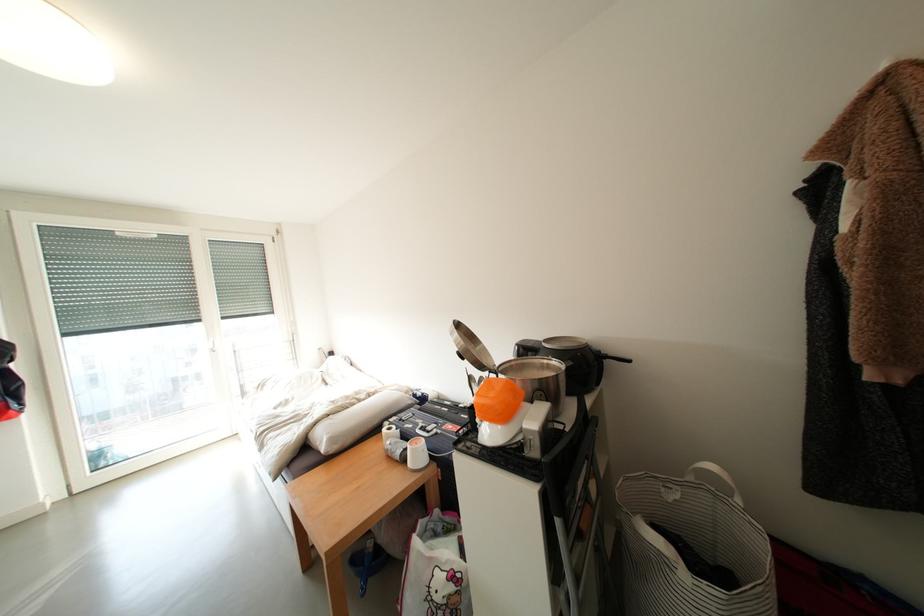
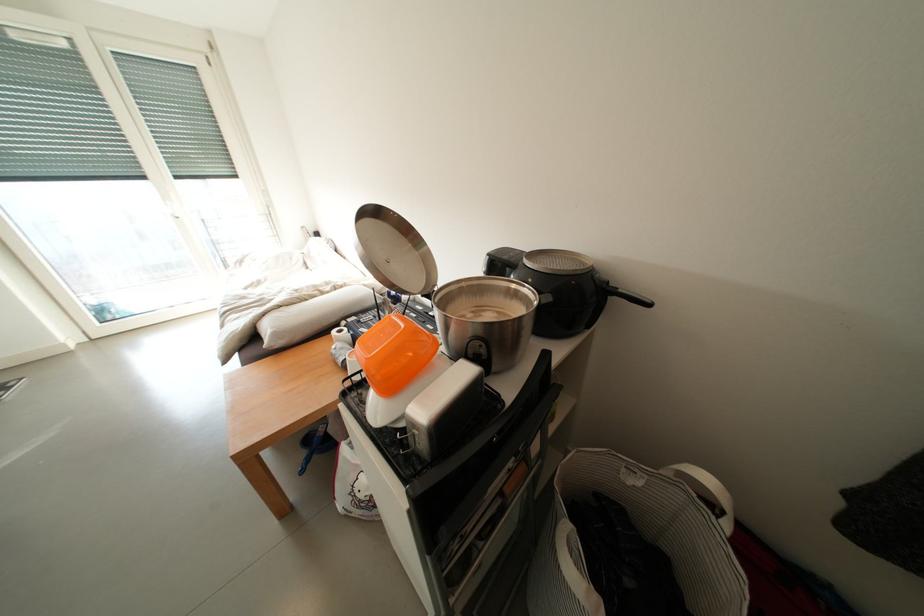
Question: The first image is from the beginning of the video and the second image is from the end. How did the camera likely rotate when shooting the video?

Choices:
 (A) Left
 (B) Right
 (C) Up
 (D) Down

Answer: (D)